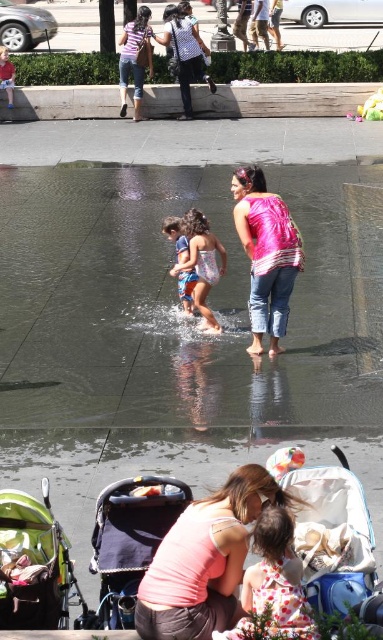
Is the position of clear water at center more distant than that of blue fabric baby carriage at lower right?

Yes, it is behind blue fabric baby carriage at lower right.

Who is positioned more to the right, clear water at center or blue fabric baby carriage at lower right?

From the viewer's perspective, blue fabric baby carriage at lower right appears more on the right side.

Which is behind, point (289, 412) or point (309, 593)?

Point (289, 412)

I want to click on clear water at center, so click(173, 305).

Does light blue denim shorts at center come in front of blue denim shorts at center?

Yes.

Is point (191, 237) closer to camera compared to point (189, 273)?

Yes, it is.

I want to click on light blue denim shorts at center, so click(x=201, y=262).

Between blue fabric baby carriage at lower right and blue denim shorts at center, which one appears on the right side from the viewer's perspective?

blue fabric baby carriage at lower right

Is blue fabric baby carriage at lower right to the left of blue denim shorts at center from the viewer's perspective?

No, blue fabric baby carriage at lower right is not to the left of blue denim shorts at center.

Who is more distant from viewer, [325,579] or [170,228]?

Positioned behind is point [170,228].

At what (x,y) coordinates should I click in order to perform the action: click on blue fabric baby carriage at lower right. Please return your answer as a coordinate pair (x, y). The height and width of the screenshot is (640, 383). Looking at the image, I should click on (330, 529).